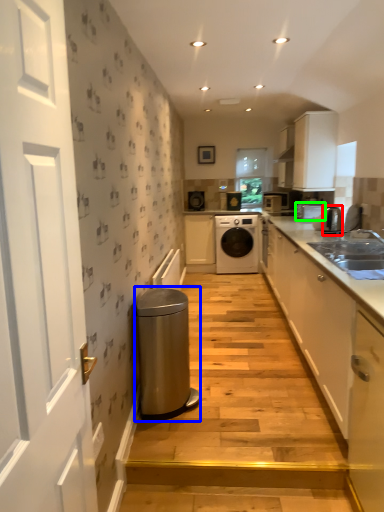
Question: Based on their relative distances, which object is farther from appliance (highlighted by a red box)? Choose from water heater (highlighted by a blue box) and appliance (highlighted by a green box).

Choices:
 (A) water heater
 (B) appliance

Answer: (A)